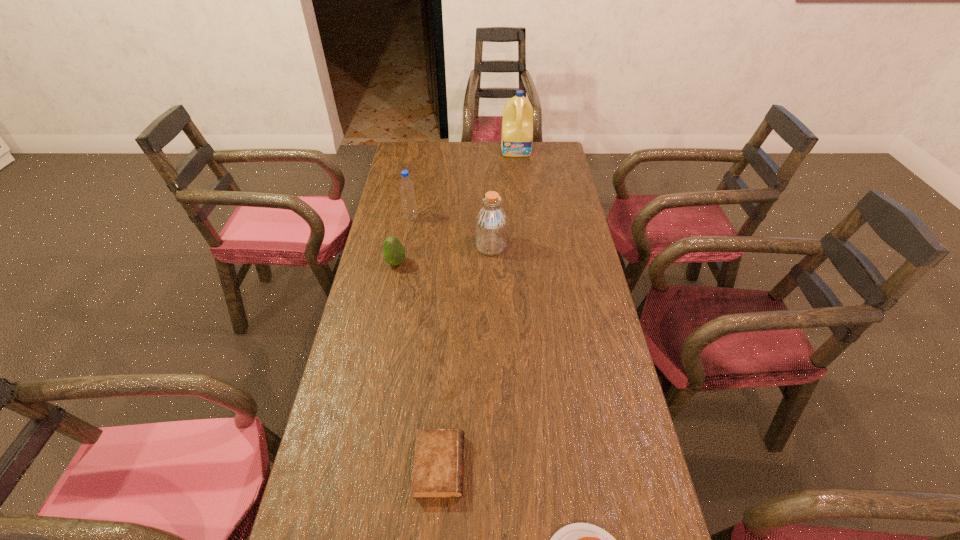
Identify which object is the second closest to the third object from right to left. Please provide its 2D coordinates. Your answer should be formatted as a tuple, i.e. [(x, y)], where the tuple contains the x and y coordinates of a point satisfying the conditions above.

[(406, 186)]

Locate an element on the screen. This screenshot has width=960, height=540. the closest object to the third shortest object is located at coordinates (406, 186).

The width and height of the screenshot is (960, 540). What are the coordinates of `free location that satisfies the following two spatial constraints: 1. on the label of the detergent; 2. on the spine side of the second nearest object` in the screenshot? It's located at (554, 466).

Where is `vacant area that satisfies the following two spatial constraints: 1. on the label of the detergent; 2. on the spine side of the diary`? Image resolution: width=960 pixels, height=540 pixels. vacant area that satisfies the following two spatial constraints: 1. on the label of the detergent; 2. on the spine side of the diary is located at coordinates (554, 466).